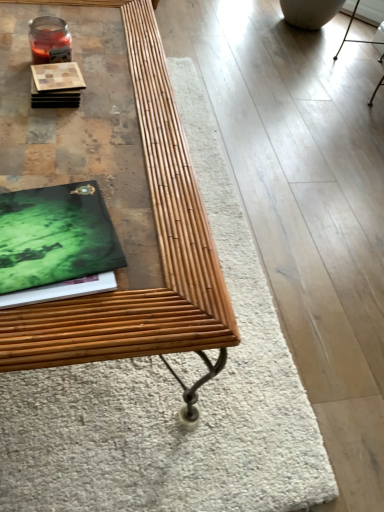
Question: Considering the positions of bamboo table at center and green matte book at left in the image, is bamboo table at center wider or thinner than green matte book at left?

Choices:
 (A) thin
 (B) wide

Answer: (B)

Question: Which is correct: bamboo table at center is inside green matte book at left, or outside of it?

Choices:
 (A) inside
 (B) outside

Answer: (B)

Question: Based on their relative distances, which object is nearer to the bamboo table at center?

Choices:
 (A) green matte book at left
 (B) wooden coaster at upper left

Answer: (A)

Question: Considering the real-world distances, which object is farthest from the wooden coaster at upper left?

Choices:
 (A) bamboo table at center
 (B) green matte book at left

Answer: (B)